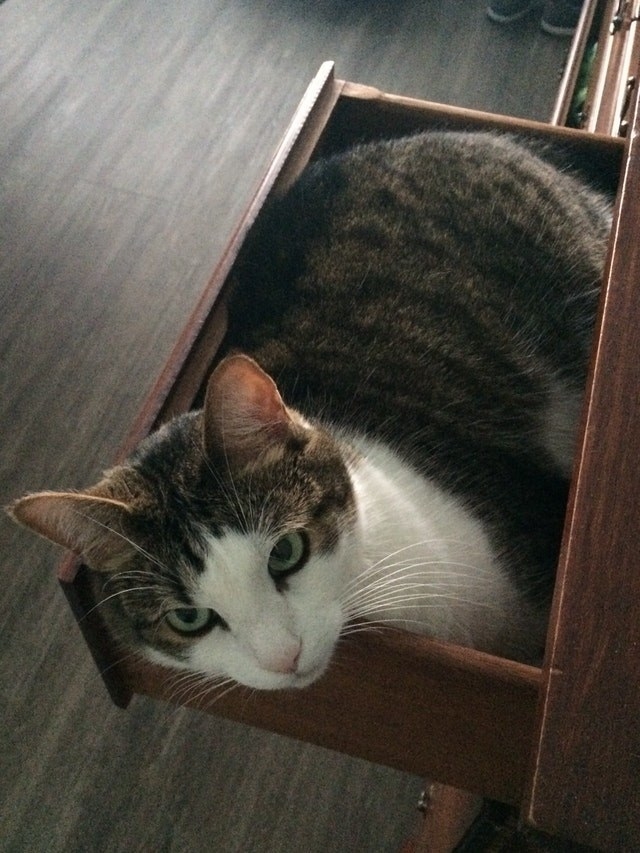
At what (x,y) coordinates should I click in order to perform the action: click on chest of drawers. Please return your answer as a coordinate pair (x, y). The image size is (640, 853). Looking at the image, I should click on (586, 646).